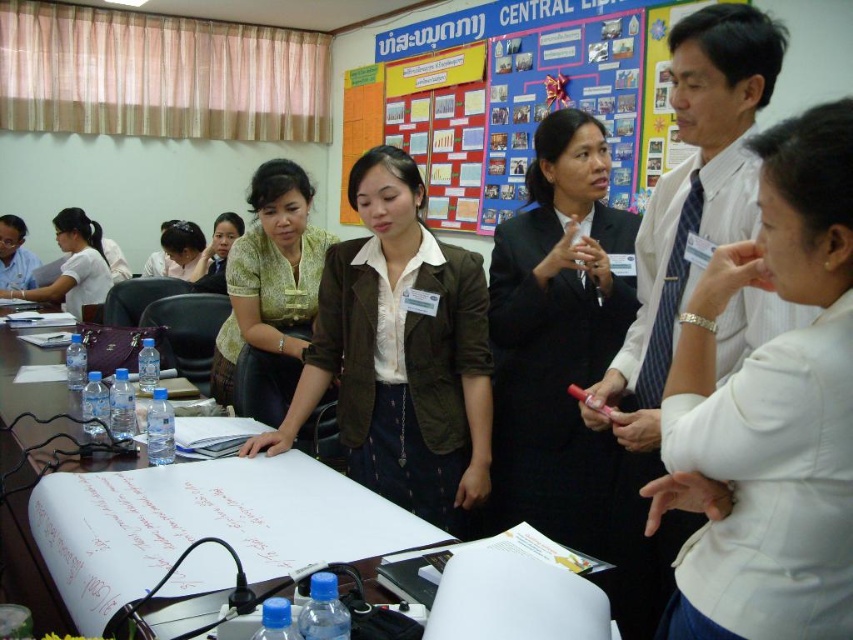
You are an observer in the meeting room. You notice the brown fabric jacket at center and the matte yellow blouse at center. Which one is positioned to the right side from your perspective?

The brown fabric jacket at center is to the right of the matte yellow blouse at center, so the brown fabric jacket at center is positioned to the right side.